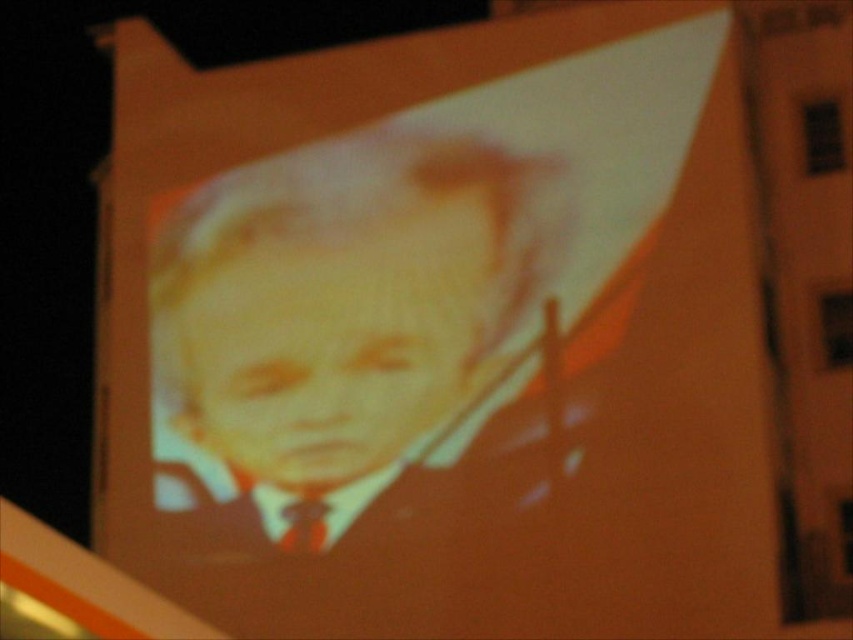
Question: Which point is closer to the camera taking this photo?

Choices:
 (A) (289, 544)
 (B) (186, 388)

Answer: (A)

Question: Can you confirm if smooth orange face at center is wider than matte brown tie at lower center?

Choices:
 (A) yes
 (B) no

Answer: (A)

Question: Which point is closer to the camera?

Choices:
 (A) (357, 396)
 (B) (273, 212)
 (C) (300, 524)

Answer: (C)

Question: Is smooth orange face at center below matte brown tie at lower center?

Choices:
 (A) no
 (B) yes

Answer: (A)

Question: Can you confirm if matte yellow portrait at center is smaller than smooth orange face at center?

Choices:
 (A) yes
 (B) no

Answer: (B)

Question: Considering the real-world distances, which object is closest to the smooth orange face at center?

Choices:
 (A) matte brown tie at lower center
 (B) matte yellow portrait at center

Answer: (B)